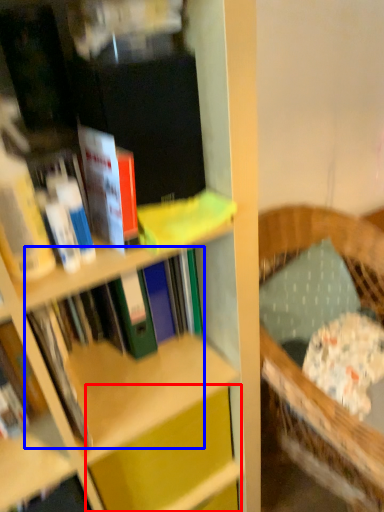
Question: Which of the following is the closest to the observer, cabinet (highlighted by a red box) or book (highlighted by a blue box)?

Choices:
 (A) cabinet
 (B) book

Answer: (B)